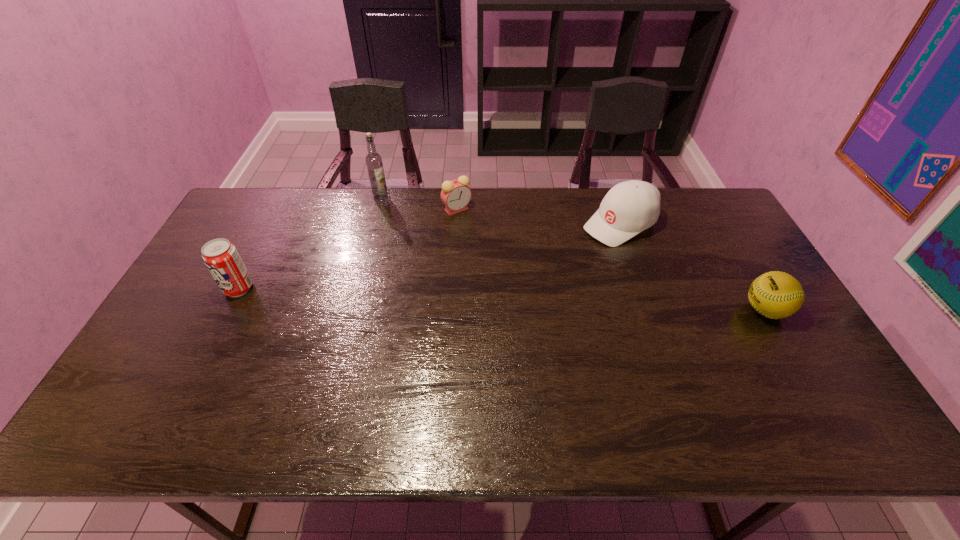
At what (x,y) coordinates should I click in order to perform the action: click on free space located on the label of the second object from left to right. Please return your answer as a coordinate pair (x, y). Image resolution: width=960 pixels, height=540 pixels. Looking at the image, I should click on (398, 241).

Find the location of a particular element. Image resolution: width=960 pixels, height=540 pixels. free location located 0.110m on the label of the second object from left to right is located at coordinates (390, 219).

Locate an element on the screen. This screenshot has height=540, width=960. vacant space situated on the label of the second object from left to right is located at coordinates (405, 256).

Find the location of `vacant area situated on the face of the third object from right to left`. vacant area situated on the face of the third object from right to left is located at coordinates (448, 234).

In order to click on blank space located 0.370m on the face of the third object from right to left in this screenshot , I will do coord(427,296).

The height and width of the screenshot is (540, 960). In order to click on vacant space situated on the face of the third object from right to left in this screenshot , I will do `click(443, 252)`.

The height and width of the screenshot is (540, 960). I want to click on free point located 0.340m on the front-facing side of the baseball cap, so click(x=514, y=284).

Locate an element on the screen. blank space located on the front-facing side of the baseball cap is located at coordinates (518, 280).

Identify the location of free spot located on the front-facing side of the baseball cap. (511, 285).

Locate an element on the screen. The image size is (960, 540). vodka located in the far edge section of the desktop is located at coordinates (374, 164).